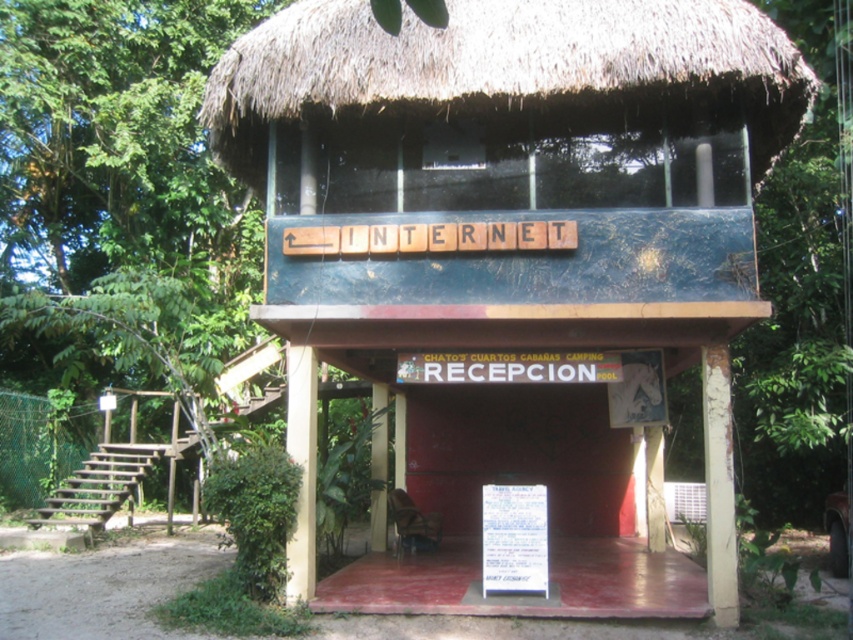
Between point (337, 90) and point (483, 493), which one is positioned in front?

Positioned in front is point (337, 90).

Is blue painted wood hut at center closer to the viewer compared to white paper sign at center?

Yes, it is in front of white paper sign at center.

Identify the location of blue painted wood hut at center. The height and width of the screenshot is (640, 853). (511, 227).